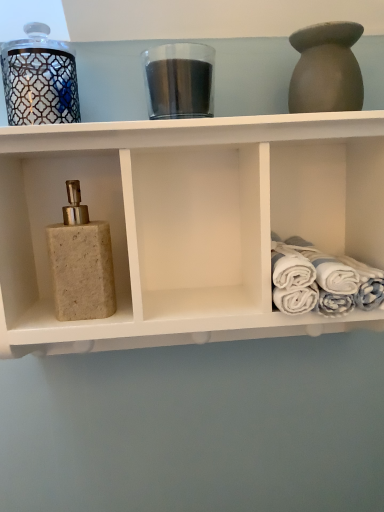
Question: From a real-world perspective, is transparent glass jar at center, which is the 1th glass jar from right to left, above or below beige stone soap dispenser at left?

Choices:
 (A) below
 (B) above

Answer: (B)

Question: Is transparent glass jar at center, which is the 1th glass jar from right to left, to the left or to the right of beige stone soap dispenser at left in the image?

Choices:
 (A) left
 (B) right

Answer: (A)

Question: Considering the real-world distances, which object is farthest from the white cotton towels at right?

Choices:
 (A) beige stone soap dispenser at left
 (B) beige stone soap dispenser at left
 (C) transparent glass jar at center, the second glass jar when ordered from left to right
 (D) matte clay vase at upper right
 (E) metallic glass candle at upper left, the first glass jar when ordered from left to right

Answer: (E)

Question: Estimate the real-world distances between objects in this image. Which object is closer to the beige stone soap dispenser at left?

Choices:
 (A) white cotton towels at right
 (B) metallic glass candle at upper left, the second glass jar from the right
 (C) beige stone soap dispenser at left
 (D) matte clay vase at upper right
 (E) transparent glass jar at center, the second glass jar when ordered from left to right

Answer: (C)